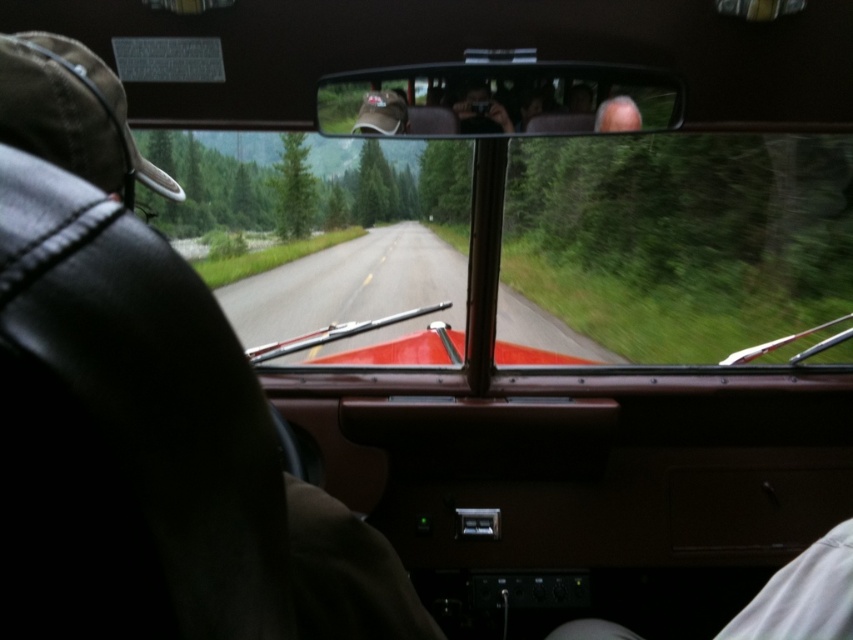
Is transparent glass windshield at center to the left of matte brown leather view mirror at upper center from the viewer's perspective?

Indeed, transparent glass windshield at center is positioned on the left side of matte brown leather view mirror at upper center.

Does transparent glass windshield at center have a lesser width compared to matte brown leather view mirror at upper center?

No, transparent glass windshield at center is not thinner than matte brown leather view mirror at upper center.

The image size is (853, 640). I want to click on transparent glass windshield at center, so click(674, 250).

I want to click on transparent glass windshield at center, so click(674, 250).